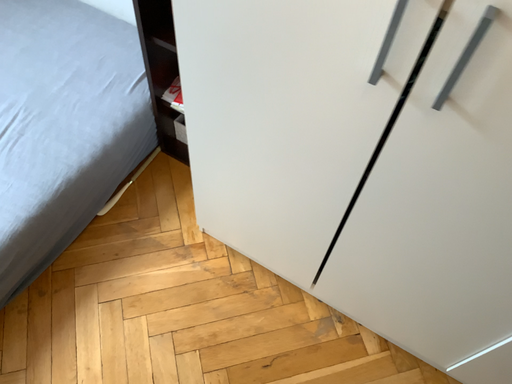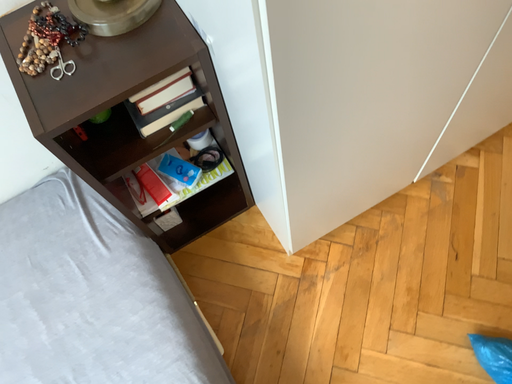
Question: How did the camera likely rotate when shooting the video?

Choices:
 (A) rotated right
 (B) rotated left

Answer: (A)